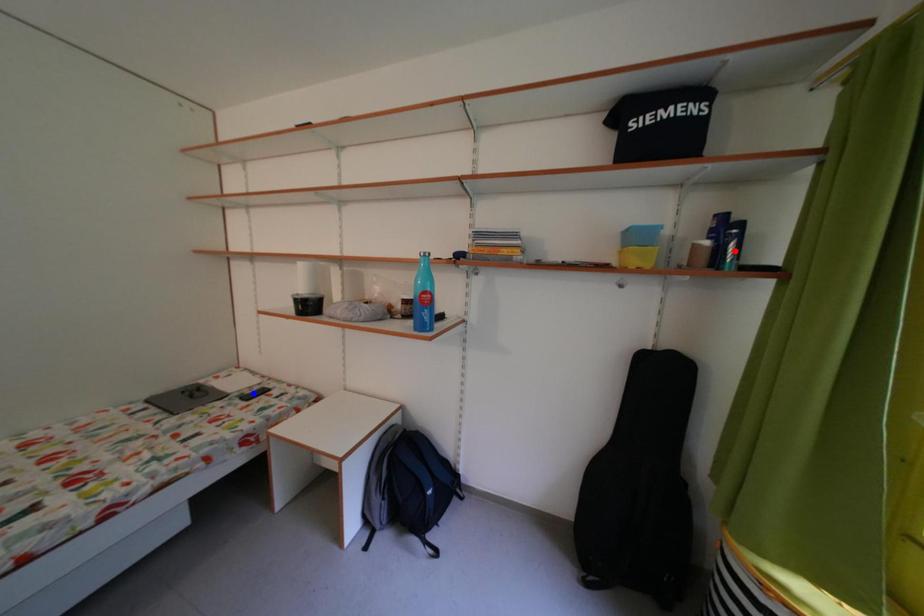
Question: In the image, two points are highlighted. Which point is nearer to the camera? Reply with the corresponding letter.

Choices:
 (A) blue point
 (B) red point

Answer: (B)